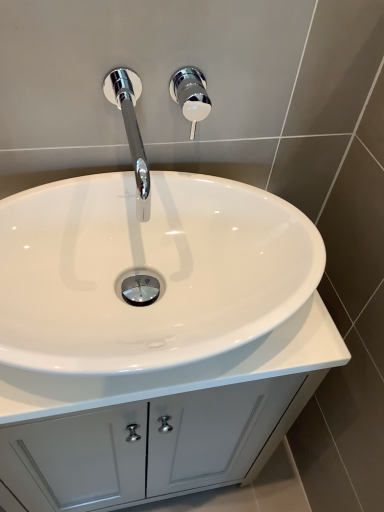
Question: Can we say chrome/polished metal shower handle at upper center lies outside white glossy cabinet at center?

Choices:
 (A) yes
 (B) no

Answer: (A)

Question: Is chrome/polished metal shower handle at upper center turned away from white glossy cabinet at center?

Choices:
 (A) no
 (B) yes

Answer: (A)

Question: From a real-world perspective, does chrome/polished metal shower handle at upper center stand above white glossy cabinet at center?

Choices:
 (A) yes
 (B) no

Answer: (A)

Question: Is chrome/polished metal shower handle at upper center at the left side of white glossy cabinet at center?

Choices:
 (A) no
 (B) yes

Answer: (A)

Question: Is chrome/polished metal shower handle at upper center far from white glossy cabinet at center?

Choices:
 (A) no
 (B) yes

Answer: (A)

Question: Considering the positions of chrome/metallic faucet at upper center and white glossy sink at center in the image, is chrome/metallic faucet at upper center wider or thinner than white glossy sink at center?

Choices:
 (A) wide
 (B) thin

Answer: (B)

Question: From their relative heights in the image, would you say chrome/metallic faucet at upper center is taller or shorter than white glossy sink at center?

Choices:
 (A) tall
 (B) short

Answer: (B)

Question: Is chrome/metallic faucet at upper center inside or outside of white glossy sink at center?

Choices:
 (A) outside
 (B) inside

Answer: (A)

Question: From a real-world perspective, is chrome/metallic faucet at upper center positioned above or below white glossy sink at center?

Choices:
 (A) above
 (B) below

Answer: (A)

Question: From a real-world perspective, relative to white glossy sink at center, is chrome/polished metal shower handle at upper center vertically above or below?

Choices:
 (A) above
 (B) below

Answer: (A)

Question: Considering the relative positions of chrome/polished metal shower handle at upper center and white glossy sink at center in the image provided, is chrome/polished metal shower handle at upper center to the left or to the right of white glossy sink at center?

Choices:
 (A) right
 (B) left

Answer: (A)

Question: Is chrome/polished metal shower handle at upper center wider or thinner than white glossy sink at center?

Choices:
 (A) wide
 (B) thin

Answer: (B)

Question: Is chrome/polished metal shower handle at upper center in front of or behind white glossy sink at center in the image?

Choices:
 (A) front
 (B) behind

Answer: (B)

Question: Is white glossy sink at center inside the boundaries of chrome/polished metal shower handle at upper center, or outside?

Choices:
 (A) inside
 (B) outside

Answer: (B)

Question: Does point (198, 185) appear closer or farther from the camera than point (177, 83)?

Choices:
 (A) closer
 (B) farther

Answer: (B)